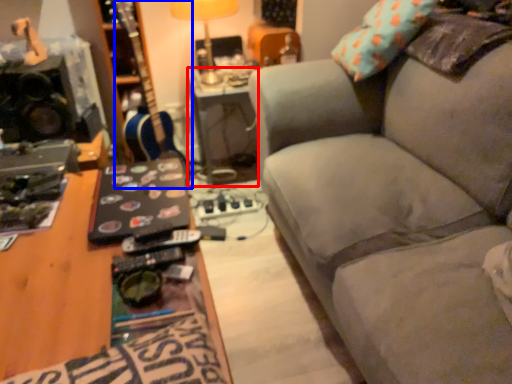
Question: Which object is closer to the camera taking this photo, table (highlighted by a red box) or guitar (highlighted by a blue box)?

Choices:
 (A) table
 (B) guitar

Answer: (B)